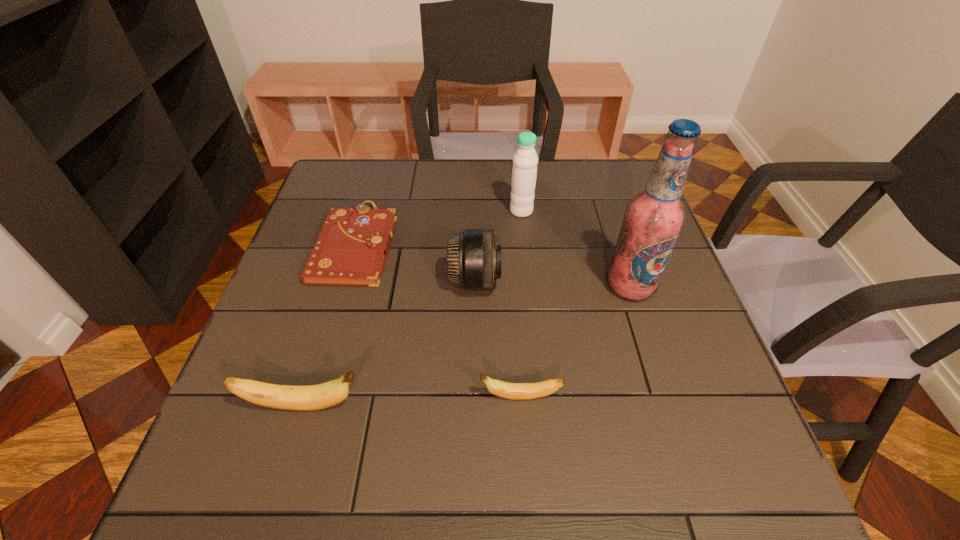
Locate an element on the screen. The image size is (960, 540). vacant position in the image that satisfies the following two spatial constraints: 1. on the front side of the fifth shortest object; 2. at the stem of the fourth tallest object is located at coordinates (542, 407).